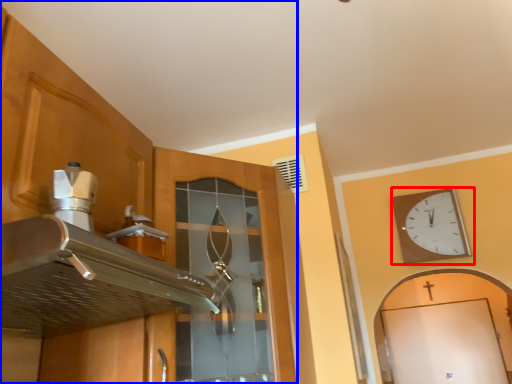
Question: Which of the following is the closest to the observer, wall clock (highlighted by a red box) or cabinetry (highlighted by a blue box)?

Choices:
 (A) wall clock
 (B) cabinetry

Answer: (B)